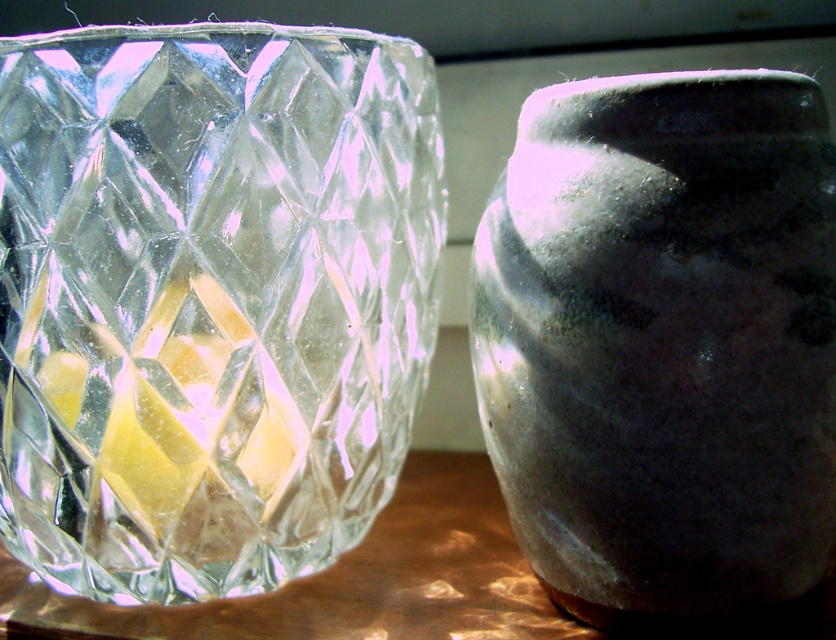
You are setting up a table for a party and want to place a tall centerpiece between the transparent crystal glass at left and the matte gray vase at right. Which object should you place the centerpiece closer to, based on their heights?

The transparent crystal glass at left is much taller than the matte gray vase at right, so you should place the centerpiece closer to the matte gray vase at right to balance the height difference.

You have a small decorative item that is 3 inches wide. You want to place it between the transparent crystal glass at left and the matte gray vase at right on the table. Can you fit it there without moving the existing items?

The distance between the transparent crystal glass at left and the matte gray vase at right is 5.74 inches. Since the decorative item is 3 inches wide, it can fit in the space between them as 3 inches is less than 5.74 inches.